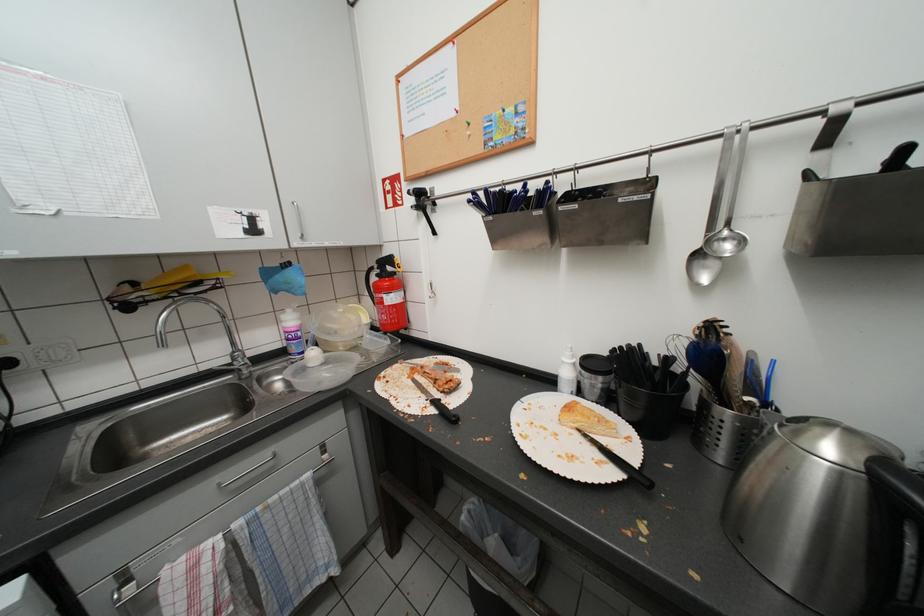
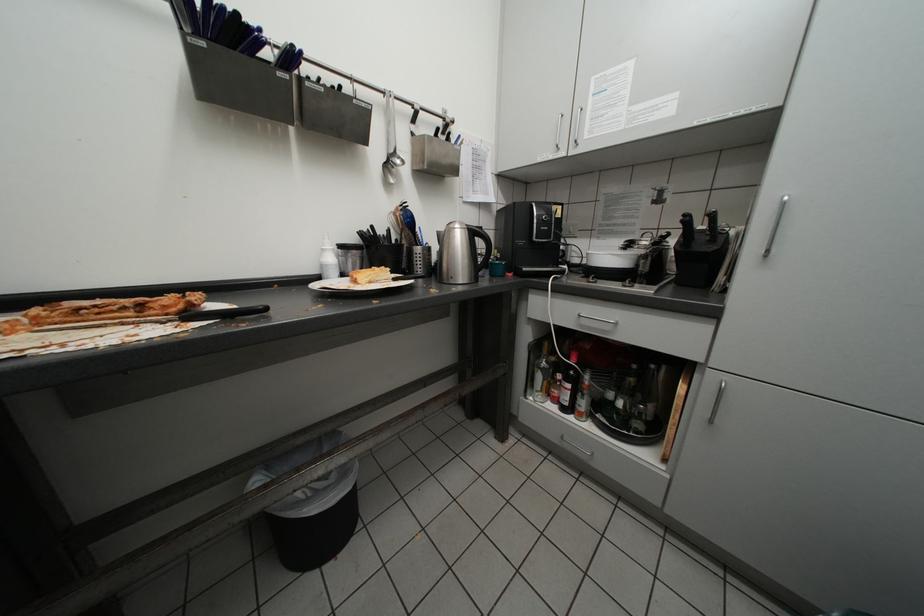
Question: Based on the continuous images, in which direction is the camera rotating? Reply with the corresponding letter.

Choices:
 (A) Left
 (B) Right
 (C) Up
 (D) Down

Answer: (B)